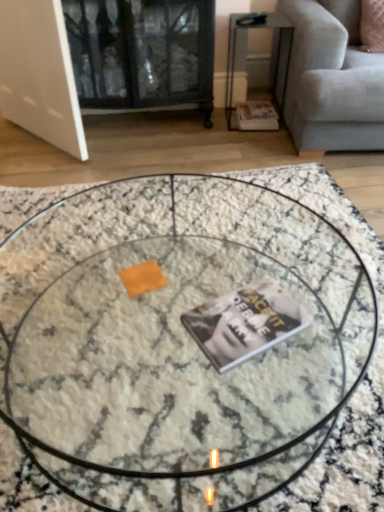
Locate an element on the screen. free space in front of metallic silver side table at upper right is located at coordinates (250, 141).